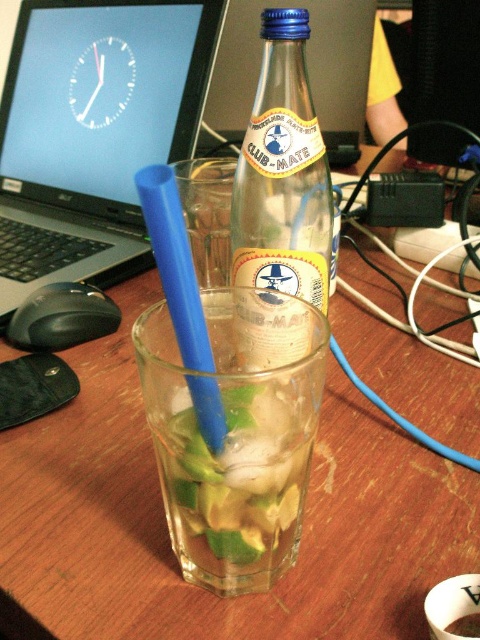
You are organizing items on a desk and need to place a new object between the black plastic laptop at upper left and the blue plastic straw at center. Based on their positions, can you estimate whether the new object should be placed closer to the laptop or the straw?

The black plastic laptop at upper left is further to the viewer than the blue plastic straw at center. Therefore, to place the new object between them, it should be positioned closer to the blue plastic straw at center since the laptop is already farther forward.

You are organizing items on a desk and want to place a new notebook between the black plastic laptop at upper left and the clear glass bottle at center. Can you do this without moving either the laptop or the bottle?

The clear glass bottle at center is behind the black plastic laptop at upper left, so there is no space between them on the desk surface. You cannot place the notebook between them without moving either object.

You are standing at the point with coordinates point (205, 346). Looking towards the point with coordinates point (285, 280), would that point be in front of or behind you?

The point with coordinates point (285, 280) is behind point (205, 346), so it would be behind you.